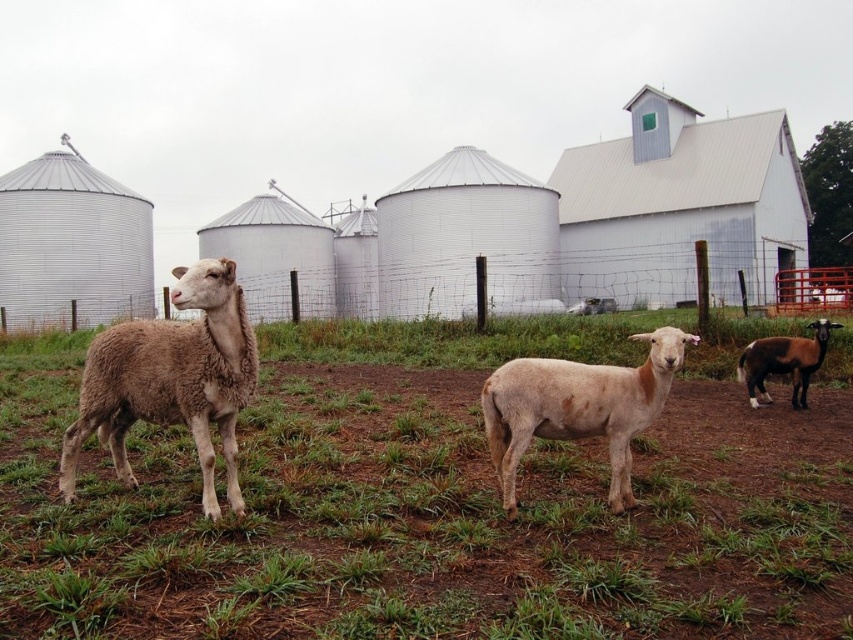
You are a farmer checking the animals in your farm. You see the light brown woolly sheep at left and the brown glossy goat at right. Which animal is wider?

The light brown woolly sheep at left is wider than the brown glossy goat at right.

You are a farmer checking the animals in your field. You see the fuzzy white sheep at center and the brown glossy goat at right. Which animal is positioned more to the left side of the field?

The fuzzy white sheep at center is positioned to the left of the brown glossy goat at right, so the fuzzy white sheep at center is more to the left side of the field.

You are standing in the middle of the farm and want to reach a specific point. You have two options to choose from, point A at coordinates point A is point (592, 385) and point B is point (822, 340). Which point is closer to you?

Point A at coordinates point (592, 385) is closer to you than point B at coordinates point (822, 340).